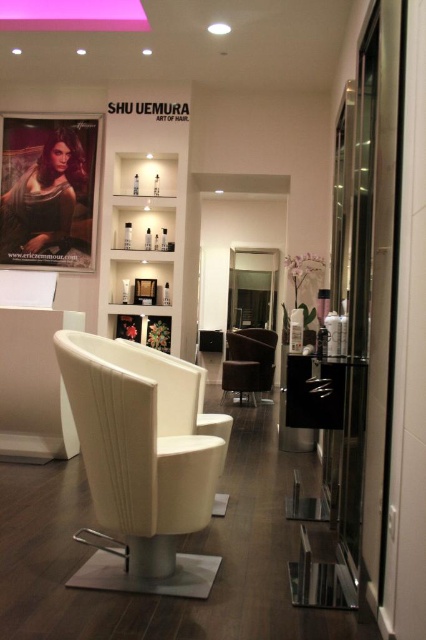
Is matte black poster at left shorter than velvet brown armchair at center?

No, matte black poster at left is not shorter than velvet brown armchair at center.

Does matte black poster at left have a larger size compared to velvet brown armchair at center?

No, matte black poster at left is not bigger than velvet brown armchair at center.

Between point (46, 257) and point (258, 381), which one is positioned behind?

Positioned behind is point (258, 381).

You are a GUI agent. You are given a task and a screenshot of the screen. Output one action in this format:
    pyautogui.click(x=<x>, y=<y>)
    Task: Click on the matte black poster at left
    Image resolution: width=426 pixels, height=640 pixels.
    Given the screenshot: What is the action you would take?
    pyautogui.click(x=48, y=192)

Is white leather swivel chair at center wider than velvet brown armchair at center?

In fact, white leather swivel chair at center might be narrower than velvet brown armchair at center.

Consider the image. How far apart are white leather swivel chair at center and velvet brown armchair at center?

The distance of white leather swivel chair at center from velvet brown armchair at center is 4.51 meters.

Find the location of a particular element. The width and height of the screenshot is (426, 640). white leather swivel chair at center is located at coordinates (141, 465).

Is white leather swivel chair at center wider than matte black poster at left?

Incorrect, white leather swivel chair at center's width does not surpass matte black poster at left's.

Measure the distance between point (115, 550) and camera.

Point (115, 550) is 2.54 meters away from camera.

Find the location of `white leather swivel chair at center`. white leather swivel chair at center is located at coordinates (141, 465).